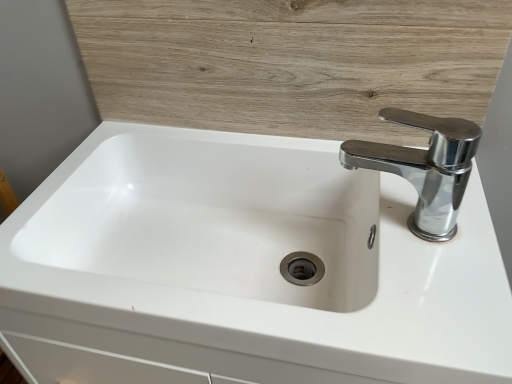
Question: Considering the relative positions of wooden panel at upper center and white glossy sink at center in the image provided, is wooden panel at upper center to the left or to the right of white glossy sink at center?

Choices:
 (A) left
 (B) right

Answer: (B)

Question: Is point (352, 130) closer or farther from the camera than point (289, 206)?

Choices:
 (A) farther
 (B) closer

Answer: (B)

Question: Which of these objects is positioned farthest from the wooden panel at upper center?

Choices:
 (A) white glossy sink at center
 (B) chrome metallic faucet at upper right

Answer: (A)

Question: Which object is the farthest from the chrome metallic faucet at upper right?

Choices:
 (A) wooden panel at upper center
 (B) white glossy sink at center

Answer: (B)